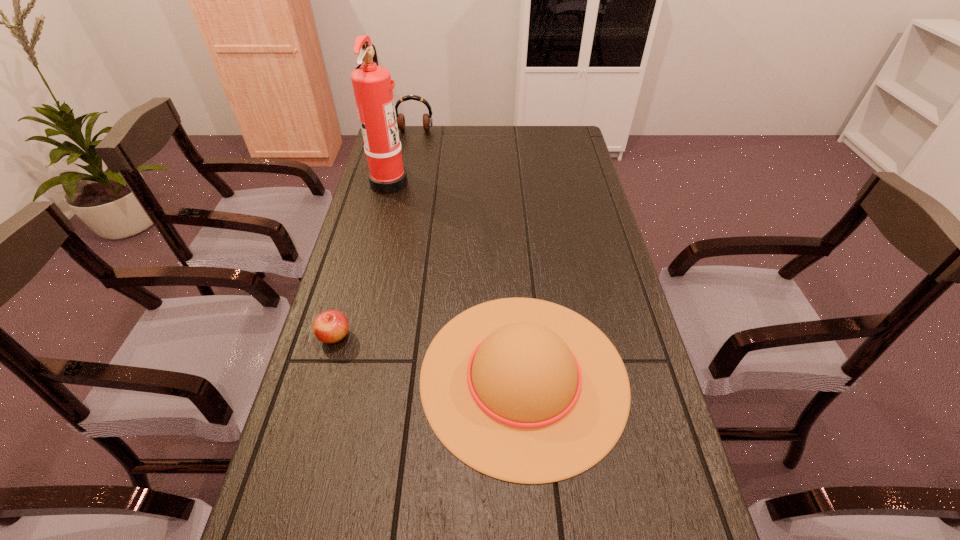
You are a GUI agent. You are given a task and a screenshot of the screen. Output one action in this format:
    pyautogui.click(x=<x>, y=<y>)
    Task: Click on the third nearest object
    Image resolution: width=960 pixels, height=540 pixels.
    Given the screenshot: What is the action you would take?
    pyautogui.click(x=372, y=84)

At what (x,y) coordinates should I click in order to perform the action: click on fire extinguisher. Please return your answer as a coordinate pair (x, y). This screenshot has width=960, height=540. Looking at the image, I should click on (372, 84).

Where is `headset`? The width and height of the screenshot is (960, 540). headset is located at coordinates (427, 119).

Locate an element on the screen. the farthest object is located at coordinates (427, 119).

Where is `the rightmost object`? The width and height of the screenshot is (960, 540). the rightmost object is located at coordinates (523, 390).

Locate an element on the screen. This screenshot has width=960, height=540. the second shortest object is located at coordinates (523, 390).

Locate an element on the screen. Image resolution: width=960 pixels, height=540 pixels. the shortest object is located at coordinates (331, 326).

Find the location of `free location located at the nozzle of the fire extinguisher`. free location located at the nozzle of the fire extinguisher is located at coordinates (474, 182).

Identify the location of free space located 0.320m on the ear cup of the farthest object. The height and width of the screenshot is (540, 960). point(405,179).

I want to click on blank area located on the back of the rightmost object, so click(515, 256).